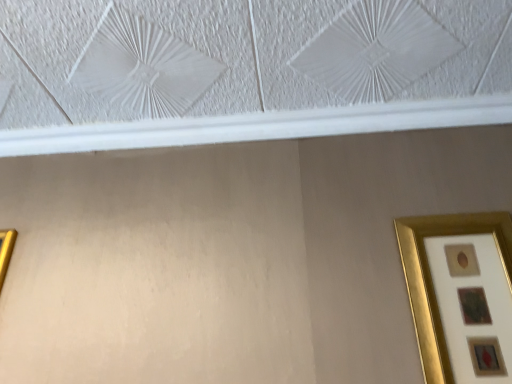
Question: Is gold metallic picture frame at right, the 2th picture frame in the left-to-right sequence, bigger or smaller than gold metallic picture frame at left, acting as the 1th picture frame starting from the left?

Choices:
 (A) big
 (B) small

Answer: (B)

Question: Is gold metallic picture frame at right, the 2th picture frame in the left-to-right sequence, to the left or to the right of gold metallic picture frame at left, acting as the 1th picture frame starting from the left, in the image?

Choices:
 (A) left
 (B) right

Answer: (B)

Question: Is gold metallic picture frame at right, which is the first picture frame in right-to-left order, wider or thinner than gold metallic picture frame at left, acting as the 1th picture frame starting from the left?

Choices:
 (A) thin
 (B) wide

Answer: (B)

Question: Visually, is gold metallic picture frame at left, positioned as the 2th picture frame in right-to-left order, positioned to the left or to the right of gold metallic picture frame at right, the 2th picture frame in the left-to-right sequence?

Choices:
 (A) left
 (B) right

Answer: (A)

Question: Which is correct: gold metallic picture frame at left, acting as the 1th picture frame starting from the left, is inside gold metallic picture frame at right, the 2th picture frame in the left-to-right sequence, or outside of it?

Choices:
 (A) inside
 (B) outside

Answer: (B)

Question: In terms of width, does gold metallic picture frame at left, positioned as the 2th picture frame in right-to-left order, look wider or thinner when compared to gold metallic picture frame at right, which is the first picture frame in right-to-left order?

Choices:
 (A) wide
 (B) thin

Answer: (B)

Question: From the image's perspective, is gold metallic picture frame at left, positioned as the 2th picture frame in right-to-left order, above or below gold metallic picture frame at right, the 2th picture frame in the left-to-right sequence?

Choices:
 (A) below
 (B) above

Answer: (A)